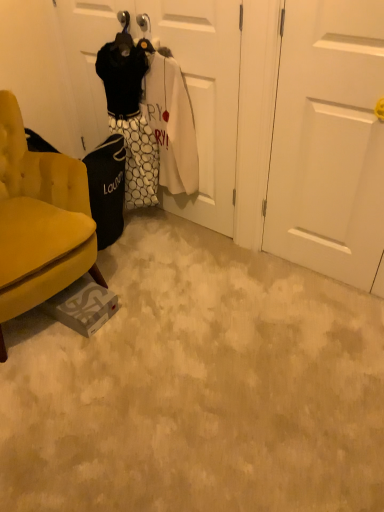
Question: In the image, is white matte door at center, which ranks as the 2th door in right-to-left order, positioned in front of or behind velvet yellow armchair at lower left?

Choices:
 (A) front
 (B) behind

Answer: (B)

Question: Considering the relative positions of white matte door at center, which is the 1th door in left-to-right order, and velvet yellow armchair at lower left in the image provided, is white matte door at center, which is the 1th door in left-to-right order, to the left or to the right of velvet yellow armchair at lower left?

Choices:
 (A) left
 (B) right

Answer: (B)

Question: Considering the real-world distances, which object is farthest from the white matte door at center, which is the 1th door in left-to-right order?

Choices:
 (A) white matte door at center, marked as the 1th door in a right-to-left arrangement
 (B) velvet yellow armchair at lower left

Answer: (B)

Question: Which object is positioned closest to the white matte door at center, marked as the 1th door in a right-to-left arrangement?

Choices:
 (A) velvet yellow armchair at lower left
 (B) white matte door at center, which ranks as the 2th door in right-to-left order

Answer: (B)